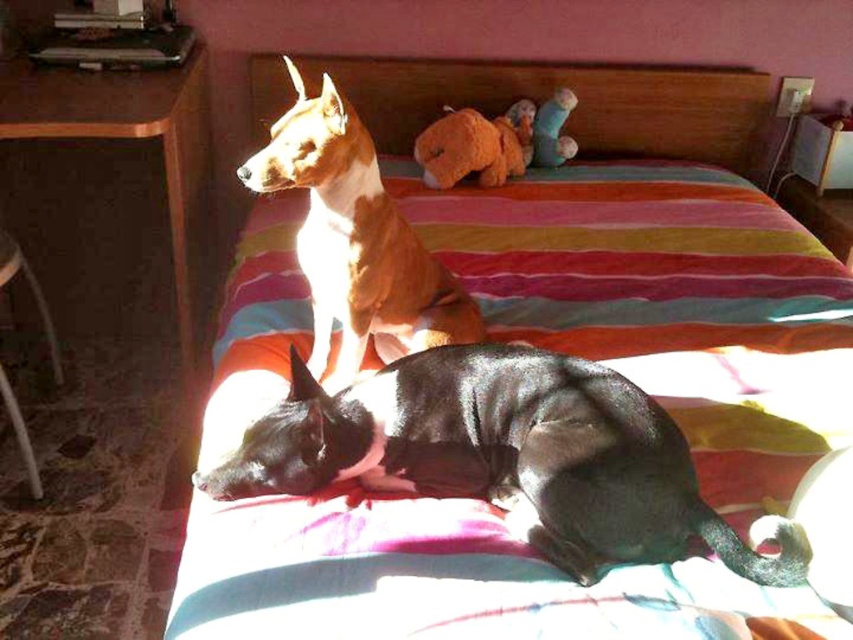
In the scene shown: Does black smooth dog at center have a larger size compared to brown glossy dog at upper center?

Actually, black smooth dog at center might be smaller than brown glossy dog at upper center.

Where is `black smooth dog at center`? black smooth dog at center is located at coordinates (506, 456).

Where is `black smooth dog at center`? This screenshot has width=853, height=640. black smooth dog at center is located at coordinates (506, 456).

Consider the image. Can you confirm if striped fabric bed at center is positioned to the right of black smooth dog at center?

In fact, striped fabric bed at center is to the left of black smooth dog at center.

Does point (804, 378) come behind point (740, 564)?

Yes, point (804, 378) is behind point (740, 564).

Describe the element at coordinates (666, 301) in the screenshot. This screenshot has width=853, height=640. I see `striped fabric bed at center` at that location.

Locate an element on the screen. The width and height of the screenshot is (853, 640). striped fabric bed at center is located at coordinates (666, 301).

Does striped fabric bed at center have a smaller size compared to brown glossy dog at upper center?

Actually, striped fabric bed at center might be larger than brown glossy dog at upper center.

Is point (846, 387) more distant than point (346, 252)?

Yes, point (846, 387) is behind point (346, 252).

The image size is (853, 640). I want to click on striped fabric bed at center, so click(x=666, y=301).